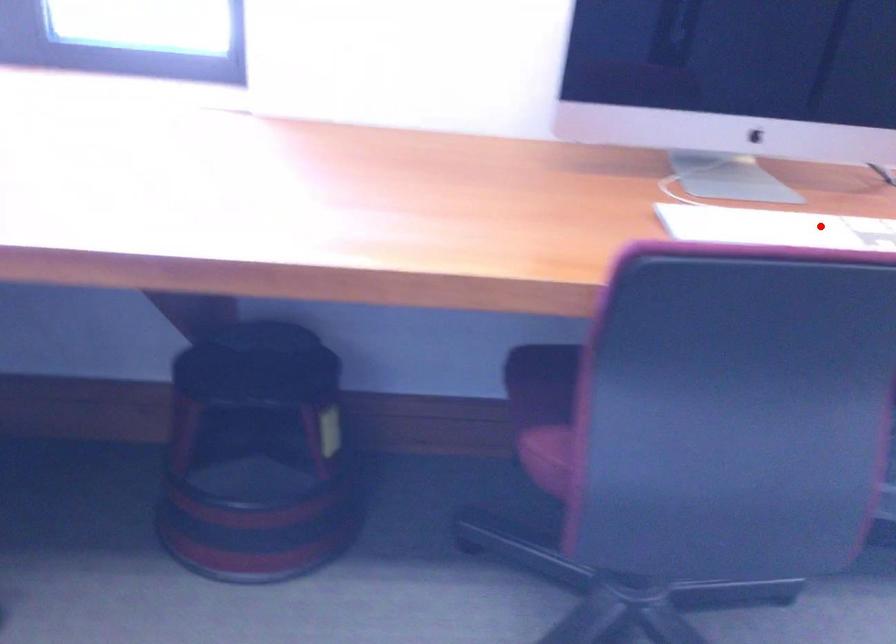
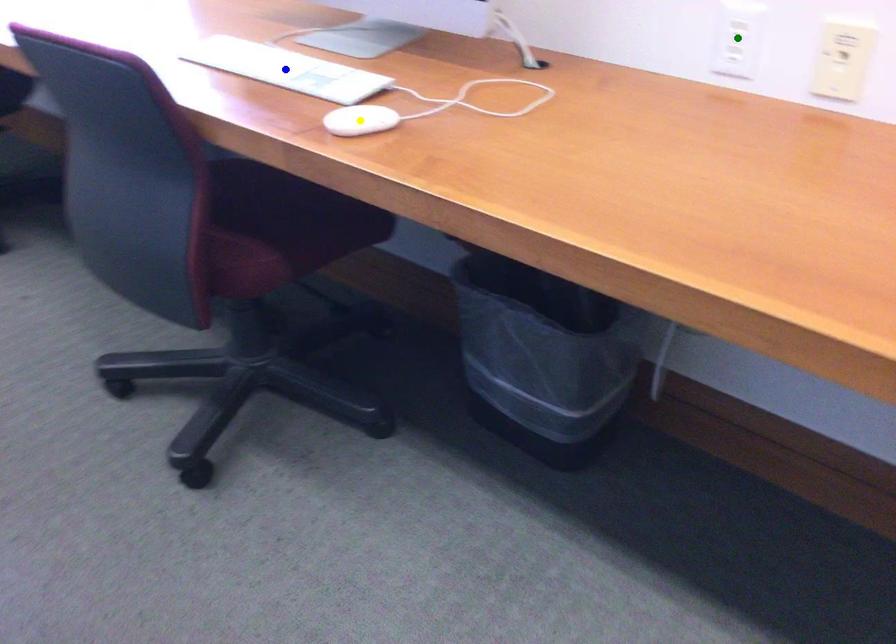
Question: I am providing you with two images of the same scene from different viewpoints. A red point is marked on the first image. You are given multiple points on the second image. In image 2, which mark is for the same physical point as the one in image 1?

Choices:
 (A) yellow point
 (B) green point
 (C) blue point

Answer: (C)